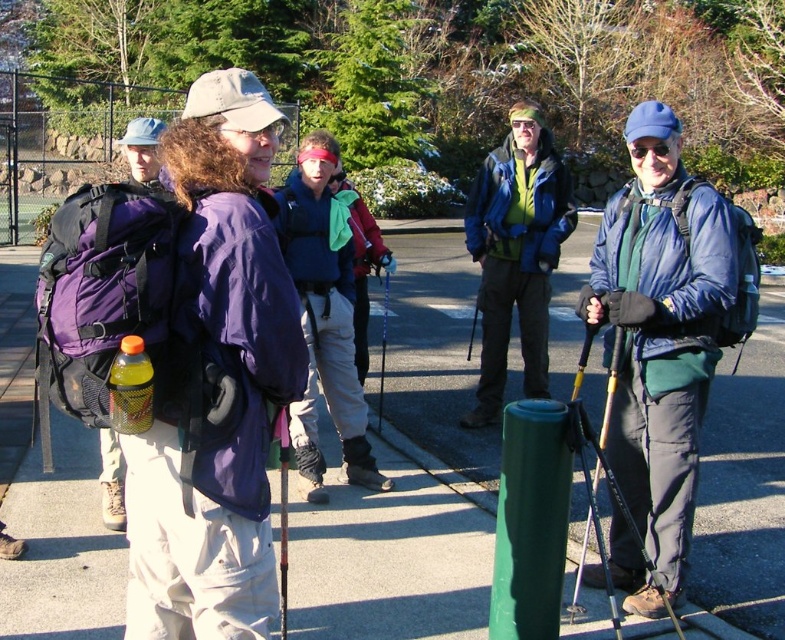
Question: Is green plastic ski pole at center closer to the viewer compared to matte black ski pole at center?

Choices:
 (A) yes
 (B) no

Answer: (A)

Question: Estimate the real-world distances between objects in this image. Which object is closer to the matte blue jacket at center?

Choices:
 (A) blue matte jacket at center
 (B) gray asphalt pavement at center
 (C) yellow metallic ski pole at lower center
 (D) purple fabric backpack at center

Answer: (A)

Question: Which object is positioned closest to the matte black ski pole at center?

Choices:
 (A) blue matte jacket at center
 (B) gray asphalt pavement at center
 (C) matte blue jacket at center

Answer: (C)

Question: Considering the real-world distances, which object is closest to the gray asphalt pavement at center?

Choices:
 (A) green plastic ski pole at center
 (B) yellow metallic ski pole at lower center
 (C) blue matte jacket at center

Answer: (B)

Question: Can you confirm if gray asphalt pavement at center is positioned below blue matte jacket at center?

Choices:
 (A) yes
 (B) no

Answer: (A)

Question: Does gray asphalt pavement at center appear on the left side of green plastic ski pole at center?

Choices:
 (A) yes
 (B) no

Answer: (B)